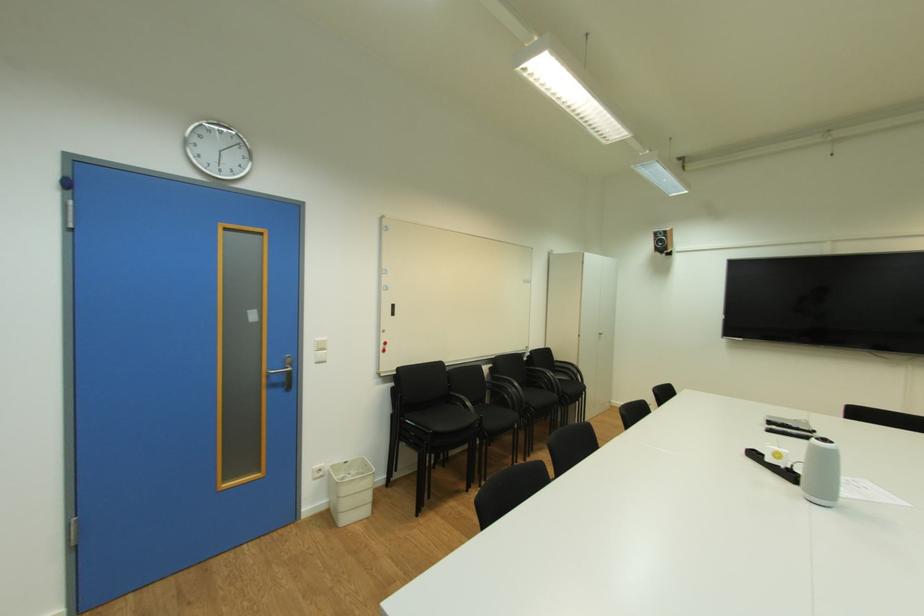
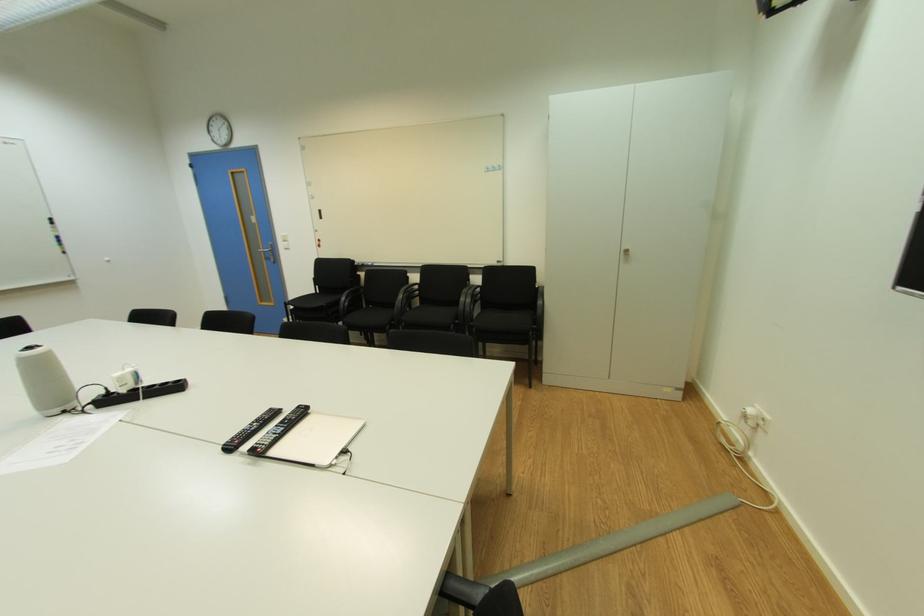
Where in the second image is the point corresponding to point 831,440 from the first image?

(34, 349)